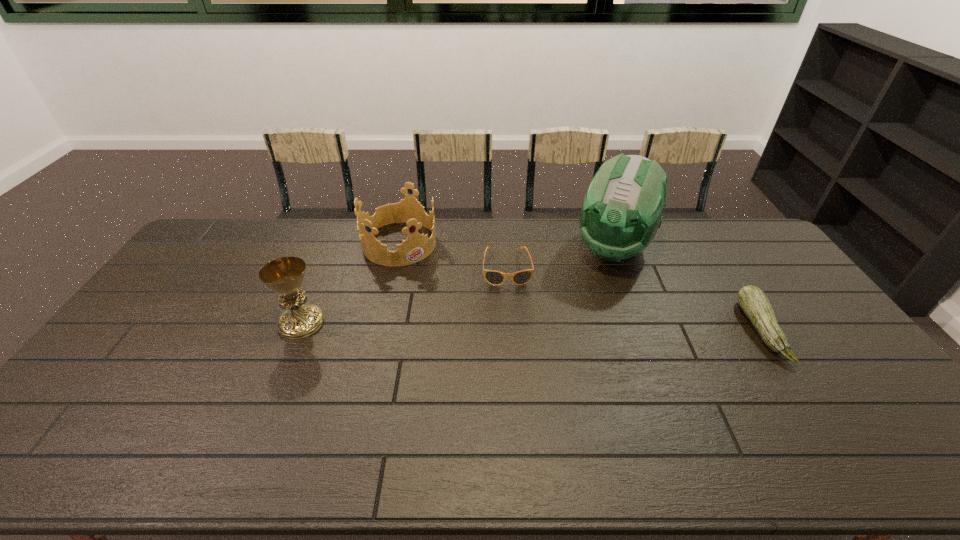
Locate an element on the screen. This screenshot has height=540, width=960. chalice is located at coordinates (285, 275).

Identify the location of the rightmost object. (753, 301).

Where is `zucchini`? The height and width of the screenshot is (540, 960). zucchini is located at coordinates (753, 301).

This screenshot has height=540, width=960. In order to click on football helmet in this screenshot , I will do `click(621, 212)`.

I want to click on the second object from right to left, so click(621, 212).

Find the location of `sunglasses`. sunglasses is located at coordinates (493, 277).

This screenshot has height=540, width=960. What are the coordinates of `the third object from left to right` in the screenshot? It's located at (493, 277).

The height and width of the screenshot is (540, 960). What are the coordinates of `the second object from left to right` in the screenshot? It's located at (416, 247).

Find the location of a particular element. The width and height of the screenshot is (960, 540). vacant area situated 0.140m on the front of the chalice is located at coordinates (277, 380).

You are a GUI agent. You are given a task and a screenshot of the screen. Output one action in this format:
    pyautogui.click(x=<x>, y=<y>)
    Task: Click on the vacant space located 0.130m at the stem end of the second shortest object
    The width and height of the screenshot is (960, 540).
    Given the screenshot: What is the action you would take?
    pyautogui.click(x=819, y=330)